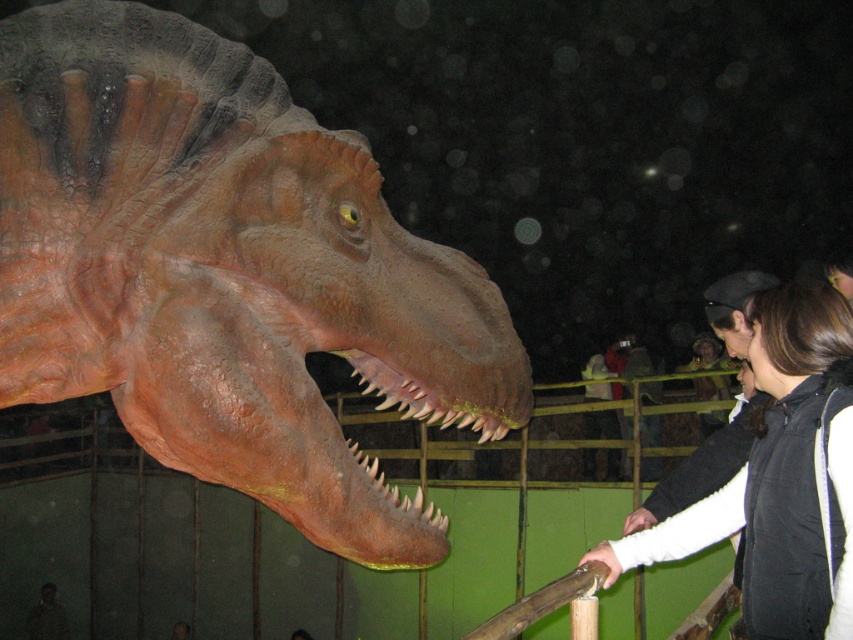
You are standing in a museum exhibit and see the matte orange dinosaur head at center and the dark brown hair at upper right. Which object is positioned more to the left side of the scene?

The matte orange dinosaur head at center is positioned to the left of the dark brown hair at upper right, so it is more to the left side of the scene.

You are a photographer standing at the camera position. The matte orange dinosaur head at center is your main subject. You have a camera with a focal length of 50mm. To ensure the entire head fits in the frame, you need to be at least 5 feet away. Are you positioned correctly?

The matte orange dinosaur head at center and camera are 5.05 feet apart, which is just over the required 5 feet. Therefore, you are positioned correctly to capture the entire head in the frame.

You are standing in a museum and see the matte orange dinosaur head at center. If you want to take a photo of it, where should you position yourself relative to the exhibit to ensure it is centered in your camera frame?

To center the matte orange dinosaur head at center in your camera frame, position yourself directly in front of it at the coordinates corresponding to its 2D location at point (225, 273).